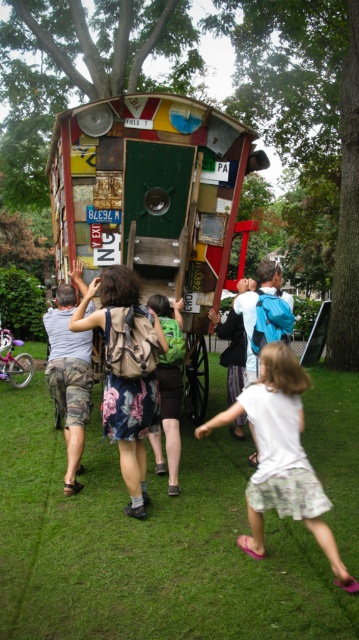
Question: Which point is closer to the camera?

Choices:
 (A) multicolored wooden wagon at center
 (B) white cotton shirt at lower right
 (C) green grass at lower center
 (D) green backpack at center

Answer: (B)

Question: Can you confirm if green grass at lower center is positioned to the left of green backpack at center?

Choices:
 (A) no
 (B) yes

Answer: (A)

Question: Among these points, which one is farthest from the camera?

Choices:
 (A) (2, 561)
 (B) (259, 525)
 (C) (114, 161)

Answer: (C)

Question: Considering the relative positions of multicolored wooden wagon at center and white cotton shirt at lower right in the image provided, where is multicolored wooden wagon at center located with respect to white cotton shirt at lower right?

Choices:
 (A) left
 (B) right

Answer: (A)

Question: Among these points, which one is nearest to the camera?

Choices:
 (A) (271, 483)
 (B) (169, 147)
 (C) (175, 374)

Answer: (A)

Question: Can you confirm if green grass at lower center is wider than multicolored wooden wagon at center?

Choices:
 (A) yes
 (B) no

Answer: (B)